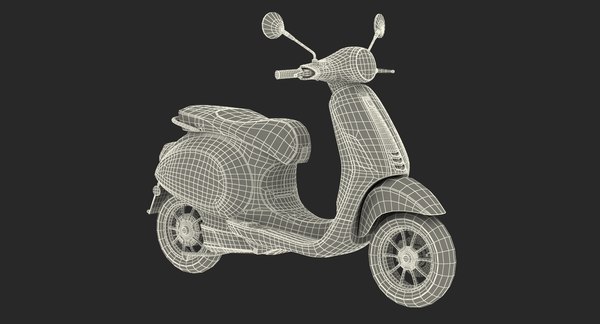
Locate an element on the screen. The width and height of the screenshot is (600, 324). backside of left mirror is located at coordinates (379, 22).